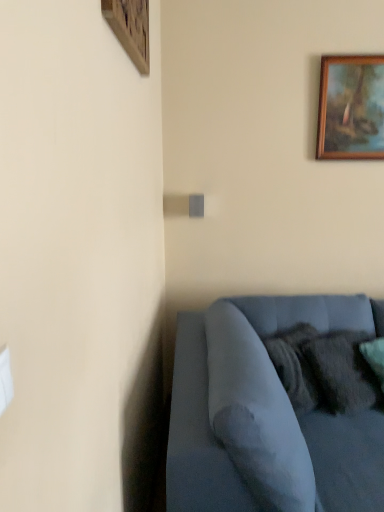
Question: Is wooden picture frame at upper left, which is the first picture frame in left-to-right order, positioned with its back to velvety dark gray pillow at lower right?

Choices:
 (A) no
 (B) yes

Answer: (A)

Question: Can you see wooden picture frame at upper left, the 2th picture frame viewed from the back, touching velvety dark gray pillow at lower right?

Choices:
 (A) no
 (B) yes

Answer: (A)

Question: Does wooden picture frame at upper left, which is counted as the 2th picture frame, starting from the right, have a greater width compared to velvety dark gray pillow at lower right?

Choices:
 (A) no
 (B) yes

Answer: (A)

Question: Is wooden picture frame at upper left, which is the first picture frame in left-to-right order, thinner than velvety dark gray pillow at lower right?

Choices:
 (A) yes
 (B) no

Answer: (A)

Question: From the image's perspective, would you say wooden picture frame at upper left, the 2th picture frame viewed from the back, is shown under velvety dark gray pillow at lower right?

Choices:
 (A) no
 (B) yes

Answer: (A)

Question: Is wooden picture frame at upper right, which is counted as the second picture frame, starting from the left, in front of or behind velvet blue couch at lower right in the image?

Choices:
 (A) front
 (B) behind

Answer: (B)

Question: From the image's perspective, is wooden picture frame at upper right, marked as the 1th picture frame in a back-to-front arrangement, positioned above or below velvet blue couch at lower right?

Choices:
 (A) below
 (B) above

Answer: (B)

Question: Is wooden picture frame at upper right, which is counted as the second picture frame, starting from the left, taller or shorter than velvet blue couch at lower right?

Choices:
 (A) short
 (B) tall

Answer: (A)

Question: From a real-world perspective, is wooden picture frame at upper right, marked as the 1th picture frame in a back-to-front arrangement, above or below velvet blue couch at lower right?

Choices:
 (A) below
 (B) above

Answer: (B)

Question: Is point (334, 392) closer or farther from the camera than point (324, 59)?

Choices:
 (A) farther
 (B) closer

Answer: (B)

Question: Is velvety dark gray pillow at lower right taller or shorter than wooden picture frame at upper right, which is counted as the second picture frame, starting from the left?

Choices:
 (A) tall
 (B) short

Answer: (B)

Question: Visually, is velvety dark gray pillow at lower right positioned to the left or to the right of wooden picture frame at upper right, the 1th picture frame positioned from the right?

Choices:
 (A) left
 (B) right

Answer: (A)

Question: Relative to wooden picture frame at upper right, which is counted as the second picture frame, starting from the left, is velvety dark gray pillow at lower right in front or behind?

Choices:
 (A) behind
 (B) front

Answer: (B)

Question: Which is correct: wooden picture frame at upper right, the 1th picture frame positioned from the right, is inside wooden picture frame at upper left, which is counted as the 1th picture frame, starting from the front, or outside of it?

Choices:
 (A) inside
 (B) outside

Answer: (B)

Question: In the image, is wooden picture frame at upper right, marked as the 1th picture frame in a back-to-front arrangement, positioned in front of or behind wooden picture frame at upper left, which is the first picture frame in left-to-right order?

Choices:
 (A) behind
 (B) front

Answer: (A)